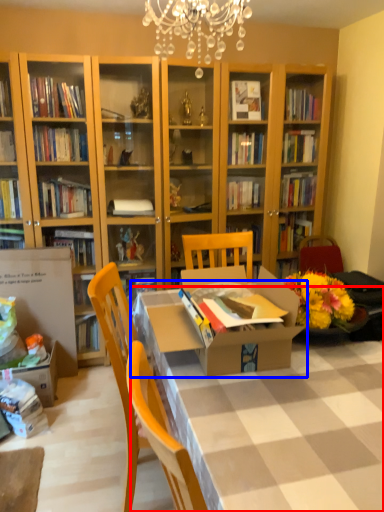
Question: Among these objects, which one is farthest to the camera, desk (highlighted by a red box) or table (highlighted by a blue box)?

Choices:
 (A) desk
 (B) table

Answer: (B)